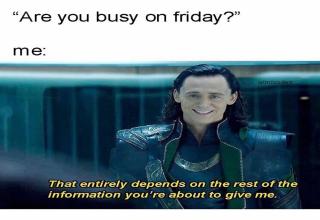
You are a GUI agent. You are given a task and a screenshot of the screen. Output one action in this format:
    pyautogui.click(x=<x>, y=<y>)
    Task: Click on the window
    
    Given the screenshot: What is the action you would take?
    pyautogui.click(x=152, y=93)